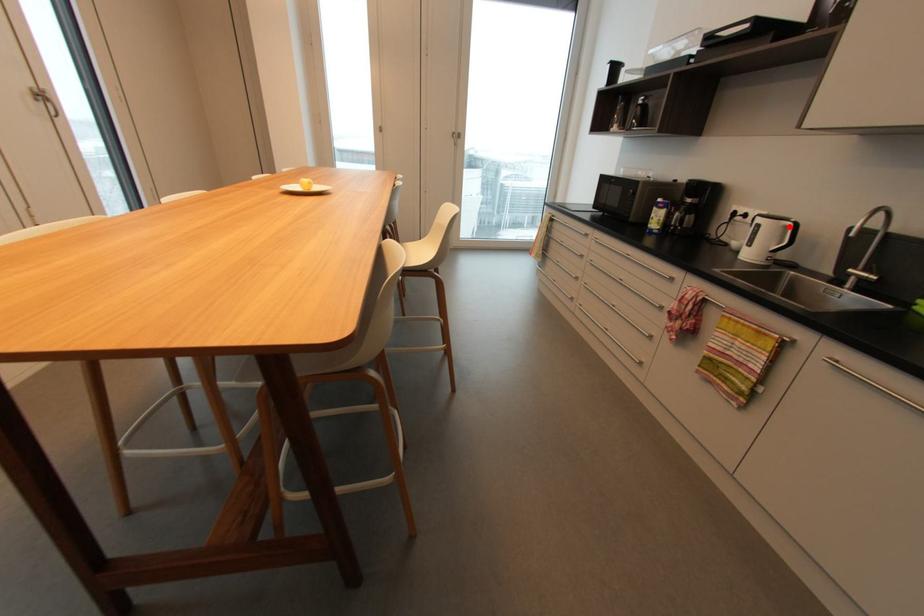
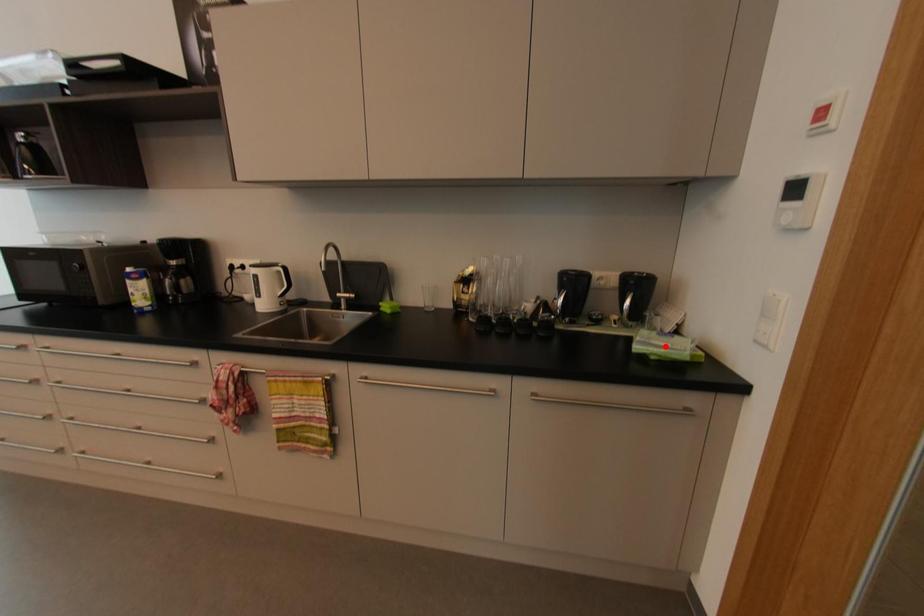
I am providing you with two images of the same scene from different viewpoints. A red point is marked on the first image and another point is marked on the second image. Do the highlighted points in image1 and image2 indicate the same real-world spot?

No